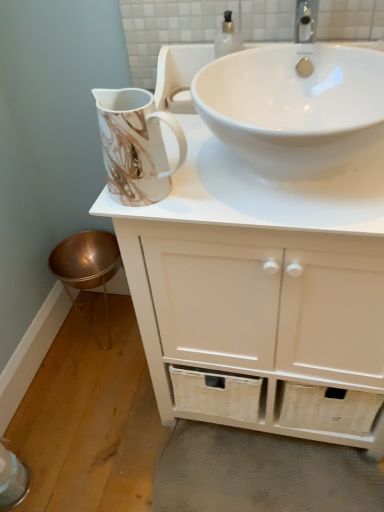
Describe the element at coordinates (261, 294) in the screenshot. I see `white matte cabinet at upper center` at that location.

The height and width of the screenshot is (512, 384). Describe the element at coordinates (261, 473) in the screenshot. I see `gray woven bath mat at lower center` at that location.

Where is `gray woven bath mat at lower center`? gray woven bath mat at lower center is located at coordinates (261, 473).

Where is `white glossy sink at upper center`? The image size is (384, 512). white glossy sink at upper center is located at coordinates (293, 106).

Can you confirm if marble-patterned ceramic jug at upper left is thinner than gray woven bath mat at lower center?

Correct, the width of marble-patterned ceramic jug at upper left is less than that of gray woven bath mat at lower center.

Is the surface of marble-patterned ceramic jug at upper left in direct contact with gray woven bath mat at lower center?

No.

From the image's perspective, which one is positioned higher, marble-patterned ceramic jug at upper left or gray woven bath mat at lower center?

marble-patterned ceramic jug at upper left appears higher in the image.

Is marble-patterned ceramic jug at upper left oriented away from gray woven bath mat at lower center?

marble-patterned ceramic jug at upper left does not have its back to gray woven bath mat at lower center.

Consider the image. Does white glossy sink at upper center have a lesser height compared to marble-patterned ceramic jug at upper left?

Indeed, white glossy sink at upper center has a lesser height compared to marble-patterned ceramic jug at upper left.

Are white glossy sink at upper center and marble-patterned ceramic jug at upper left beside each other?

No, white glossy sink at upper center is not in contact with marble-patterned ceramic jug at upper left.

Is point (356, 131) closer to camera compared to point (176, 167)?

Yes, it is in front of point (176, 167).

Is marble-patterned ceramic jug at upper left at the back of white glossy sink at upper center?

No.

Is white glossy sink at upper center aimed at gray woven bath mat at lower center?

No, white glossy sink at upper center is not turned towards gray woven bath mat at lower center.

Is white glossy sink at upper center situated inside gray woven bath mat at lower center or outside?

white glossy sink at upper center is outside gray woven bath mat at lower center.

Is the surface of white glossy sink at upper center in direct contact with gray woven bath mat at lower center?

No, white glossy sink at upper center is not beside gray woven bath mat at lower center.

Considering the sizes of objects white glossy sink at upper center and white matte cabinet at upper center in the image provided, who is thinner, white glossy sink at upper center or white matte cabinet at upper center?

Thinner between the two is white glossy sink at upper center.

Which object is further away from the camera, white glossy sink at upper center or white matte cabinet at upper center?

white glossy sink at upper center.

Is white glossy sink at upper center facing towards white matte cabinet at upper center?

Yes.

Does point (246, 119) appear closer or farther from the camera than point (295, 182)?

Point (246, 119) is farther from the camera than point (295, 182).

Looking at this image, is gray woven bath mat at lower center next to marble-patterned ceramic jug at upper left and touching it?

There is a gap between gray woven bath mat at lower center and marble-patterned ceramic jug at upper left.

Is point (226, 429) closer to camera compared to point (151, 186)?

No, it is not.

Is gray woven bath mat at lower center to the left or to the right of marble-patterned ceramic jug at upper left in the image?

From the image, it's evident that gray woven bath mat at lower center is to the right of marble-patterned ceramic jug at upper left.

Is white matte cabinet at upper center thinner than marble-patterned ceramic jug at upper left?

Incorrect, the width of white matte cabinet at upper center is not less than that of marble-patterned ceramic jug at upper left.

Measure the distance from white matte cabinet at upper center to marble-patterned ceramic jug at upper left.

white matte cabinet at upper center is 13.61 inches from marble-patterned ceramic jug at upper left.

Which is more to the left, white matte cabinet at upper center or marble-patterned ceramic jug at upper left?

marble-patterned ceramic jug at upper left.

Is white matte cabinet at upper center looking in the opposite direction of marble-patterned ceramic jug at upper left?

No.

Is gray woven bath mat at lower center oriented away from white glossy sink at upper center?

gray woven bath mat at lower center does not have its back to white glossy sink at upper center.

Considering the relative sizes of gray woven bath mat at lower center and white glossy sink at upper center in the image provided, is gray woven bath mat at lower center taller than white glossy sink at upper center?

In fact, gray woven bath mat at lower center may be shorter than white glossy sink at upper center.

Can you tell me how much gray woven bath mat at lower center and white glossy sink at upper center differ in facing direction?

They differ by 3.18 degrees in their facing directions.

Based on their sizes in the image, would you say gray woven bath mat at lower center is bigger or smaller than white glossy sink at upper center?

In the image, gray woven bath mat at lower center appears to be smaller than white glossy sink at upper center.

This screenshot has width=384, height=512. In order to click on bath mat located on the right of marble-patterned ceramic jug at upper left in this screenshot , I will do `click(261, 473)`.

Where is `jug above the white glossy sink at upper center (from a real-world perspective)`? jug above the white glossy sink at upper center (from a real-world perspective) is located at coordinates (135, 145).

When comparing their distances from gray woven bath mat at lower center, does marble-patterned ceramic jug at upper left or white matte cabinet at upper center seem closer?

Based on the image, white matte cabinet at upper center appears to be nearer to gray woven bath mat at lower center.

Estimate the real-world distances between objects in this image. Which object is closer to white matte cabinet at upper center, white glossy sink at upper center or gray woven bath mat at lower center?

Based on the image, white glossy sink at upper center appears to be nearer to white matte cabinet at upper center.

Considering their positions, is white glossy sink at upper center positioned closer to gray woven bath mat at lower center than white matte cabinet at upper center?

white matte cabinet at upper center.

From the image, which object appears to be nearer to white glossy sink at upper center, gray woven bath mat at lower center or white matte cabinet at upper center?

Based on the image, white matte cabinet at upper center appears to be nearer to white glossy sink at upper center.

Estimate the real-world distances between objects in this image. Which object is further from marble-patterned ceramic jug at upper left, gray woven bath mat at lower center or white matte cabinet at upper center?

gray woven bath mat at lower center is further to marble-patterned ceramic jug at upper left.

Based on their spatial positions, is white glossy sink at upper center or white matte cabinet at upper center further from marble-patterned ceramic jug at upper left?

white matte cabinet at upper center is further to marble-patterned ceramic jug at upper left.

From the image, which object appears to be farther from gray woven bath mat at lower center, white matte cabinet at upper center or white glossy sink at upper center?

Among the two, white glossy sink at upper center is located further to gray woven bath mat at lower center.

Looking at the image, which one is located further to marble-patterned ceramic jug at upper left, gray woven bath mat at lower center or white glossy sink at upper center?

Based on the image, gray woven bath mat at lower center appears to be further to marble-patterned ceramic jug at upper left.

At what (x,y) coordinates should I click in order to perform the action: click on jug between white glossy sink at upper center and gray woven bath mat at lower center from top to bottom. Please return your answer as a coordinate pair (x, y). Looking at the image, I should click on (135, 145).

Identify the location of bathroom cabinet between marble-patterned ceramic jug at upper left and gray woven bath mat at lower center in the up-down direction. (261, 294).

Where is `sink located between marble-patterned ceramic jug at upper left and white matte cabinet at upper center in the left-right direction`? This screenshot has width=384, height=512. sink located between marble-patterned ceramic jug at upper left and white matte cabinet at upper center in the left-right direction is located at coordinates (x=293, y=106).

Locate an element on the screen. bathroom cabinet between white glossy sink at upper center and gray woven bath mat at lower center vertically is located at coordinates (261, 294).